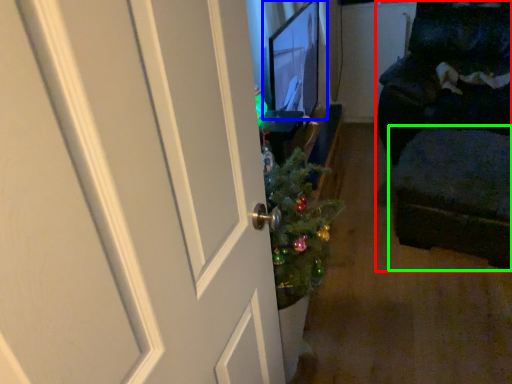
Question: Which is nearer to the furniture (highlighted by a red box)? computer monitor (highlighted by a blue box) or footrest (highlighted by a green box).

Choices:
 (A) computer monitor
 (B) footrest

Answer: (B)